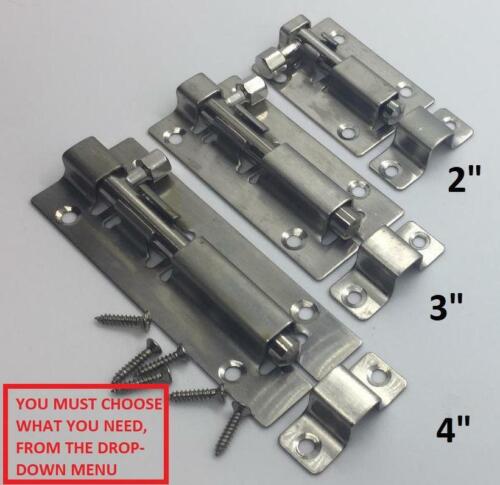
I want to click on door mount, so click(x=332, y=109), click(x=238, y=187), click(x=137, y=278).